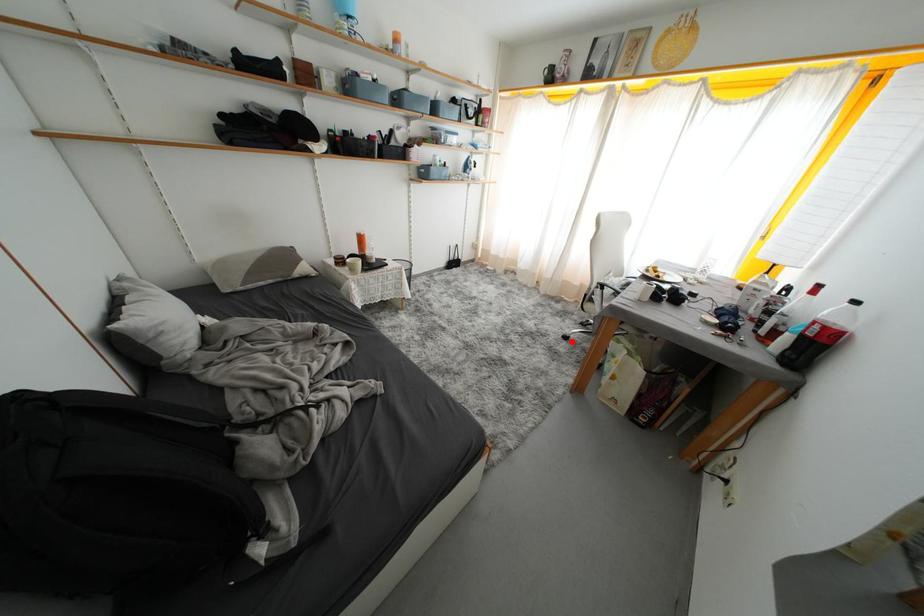
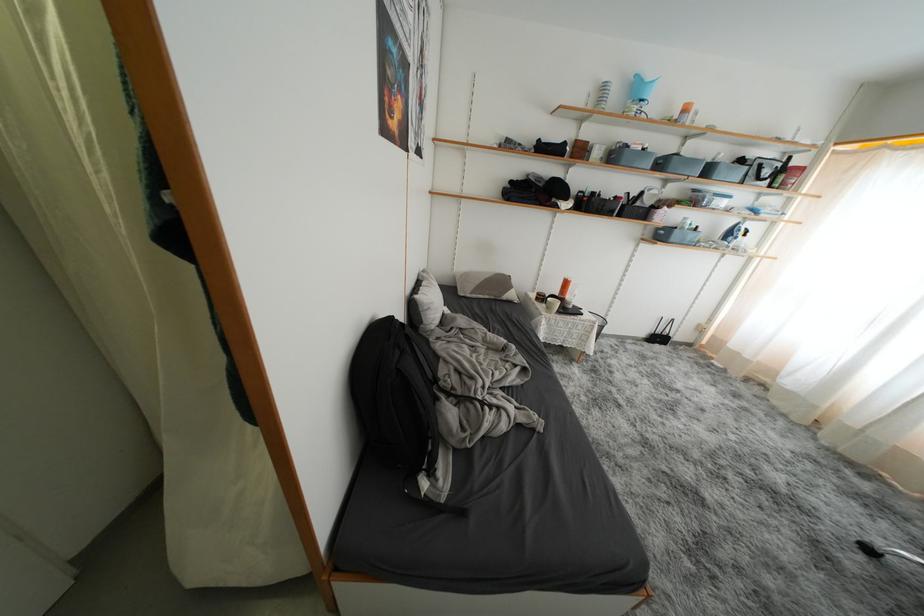
Question: I am providing you with two images of the same scene from different viewpoints. Image1 has a red point marked. In image2, the corresponding 3D location appears at what relative position? Reply with the corresponding letter.

Choices:
 (A) Closer
 (B) Farther

Answer: (B)